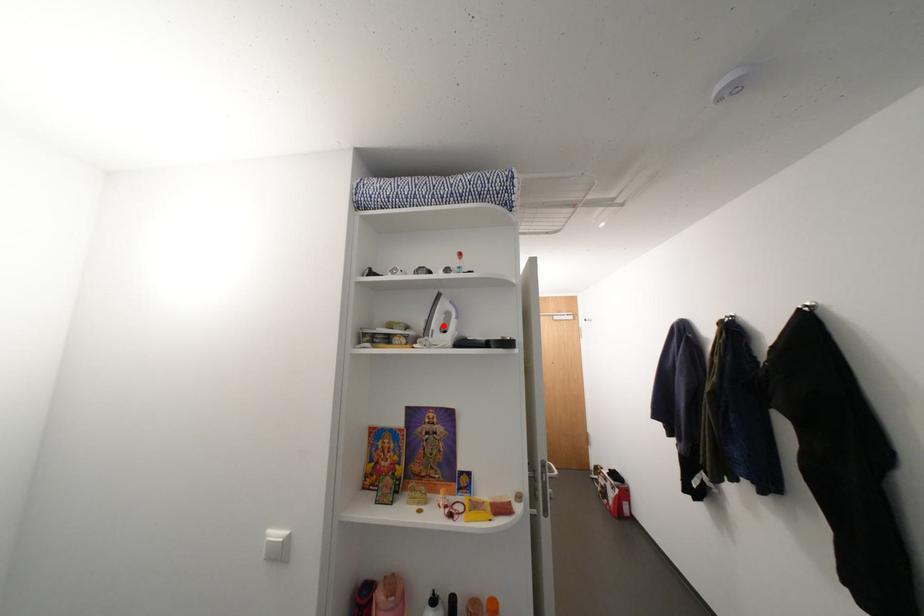
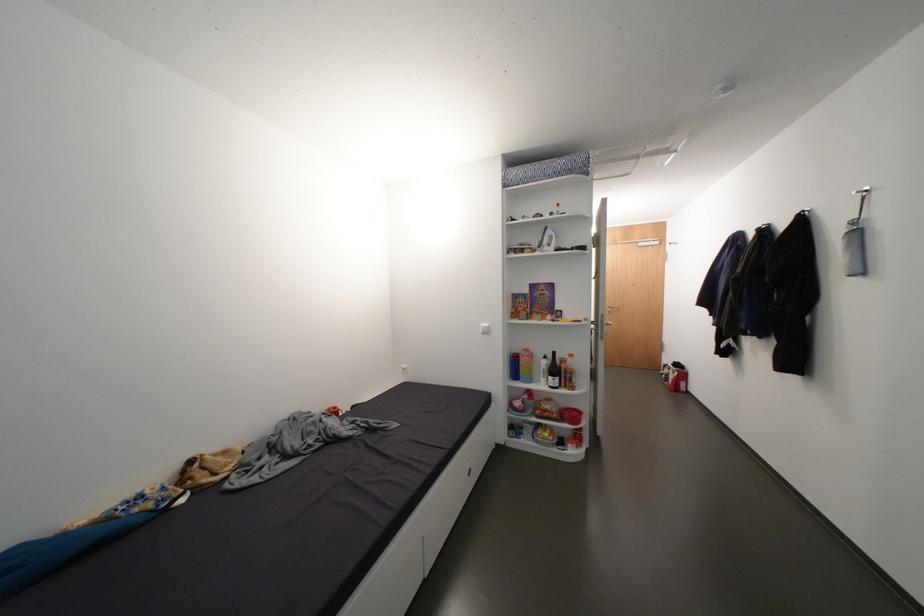
Find the pixel in the second image that matches the highlighted location in the first image.

(553, 243)